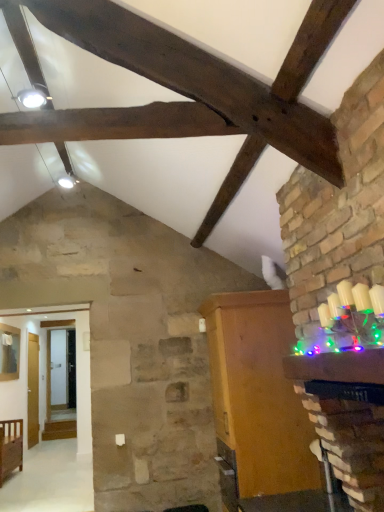
Question: Does wooden cabinet at right, the second furniture viewed from the back, have a larger size compared to brown wooden cabinet at upper center?

Choices:
 (A) yes
 (B) no

Answer: (A)

Question: Can you confirm if wooden cabinet at right, positioned as the second furniture in left-to-right order, is positioned to the right of brown wooden cabinet at upper center?

Choices:
 (A) yes
 (B) no

Answer: (A)

Question: Does wooden cabinet at right, the second furniture from the bottom, have a greater width compared to brown wooden cabinet at upper center?

Choices:
 (A) no
 (B) yes

Answer: (B)

Question: Is wooden cabinet at right, the second furniture viewed from the back, thinner than brown wooden cabinet at upper center?

Choices:
 (A) no
 (B) yes

Answer: (A)

Question: From the image's perspective, would you say wooden cabinet at right, which is the first furniture from front to back, is shown under brown wooden cabinet at upper center?

Choices:
 (A) no
 (B) yes

Answer: (B)

Question: In terms of width, does wooden crib at lower left, positioned as the 1th furniture in back-to-front order, look wider or thinner when compared to brown wooden cabinet at upper center?

Choices:
 (A) wide
 (B) thin

Answer: (A)

Question: Considering the positions of wooden crib at lower left, positioned as the 1th furniture in back-to-front order, and brown wooden cabinet at upper center in the image, is wooden crib at lower left, positioned as the 1th furniture in back-to-front order, taller or shorter than brown wooden cabinet at upper center?

Choices:
 (A) short
 (B) tall

Answer: (A)

Question: From the image's perspective, is wooden crib at lower left, acting as the second furniture starting from the top, positioned above or below brown wooden cabinet at upper center?

Choices:
 (A) above
 (B) below

Answer: (B)

Question: Is point (1, 463) positioned closer to the camera than point (244, 177)?

Choices:
 (A) farther
 (B) closer

Answer: (A)

Question: Is brown wooden cabinet at upper center inside the boundaries of wooden crib at lower left, positioned as the 1th furniture in back-to-front order, or outside?

Choices:
 (A) outside
 (B) inside

Answer: (A)

Question: Is brown wooden cabinet at upper center taller or shorter than wooden crib at lower left, positioned as the 2th furniture in right-to-left order?

Choices:
 (A) tall
 (B) short

Answer: (A)

Question: Is brown wooden cabinet at upper center wider or thinner than wooden crib at lower left, positioned as the 1th furniture in back-to-front order?

Choices:
 (A) thin
 (B) wide

Answer: (A)

Question: Is brown wooden cabinet at upper center bigger or smaller than wooden crib at lower left, positioned as the first furniture in left-to-right order?

Choices:
 (A) big
 (B) small

Answer: (A)

Question: Is wooden cabinet at right, positioned as the second furniture in left-to-right order, situated inside brown wooden cabinet at upper center or outside?

Choices:
 (A) outside
 (B) inside

Answer: (A)

Question: From a real-world perspective, relative to brown wooden cabinet at upper center, is wooden cabinet at right, which is counted as the 1th furniture, starting from the right, vertically above or below?

Choices:
 (A) above
 (B) below

Answer: (B)